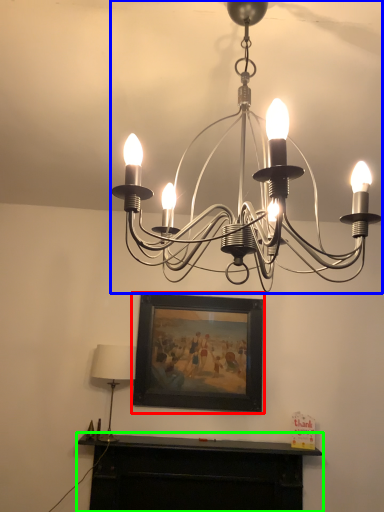
Question: Estimate the real-world distances between objects in this image. Which object is closer to picture frame (highlighted by a red box), lamp (highlighted by a blue box) or furniture (highlighted by a green box)?

Choices:
 (A) lamp
 (B) furniture

Answer: (B)